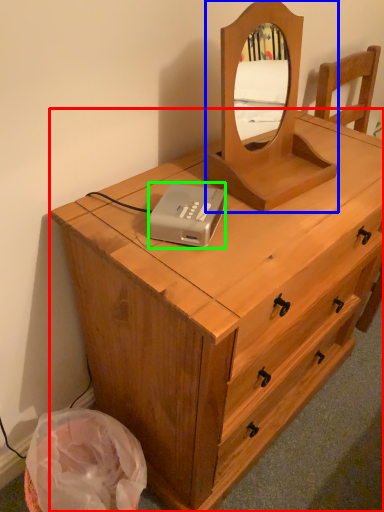
Question: Estimate the real-world distances between objects in this image. Which object is farther from chest of drawers (highlighted by a red box), mirror (highlighted by a blue box) or cassette (highlighted by a green box)?

Choices:
 (A) mirror
 (B) cassette

Answer: (B)